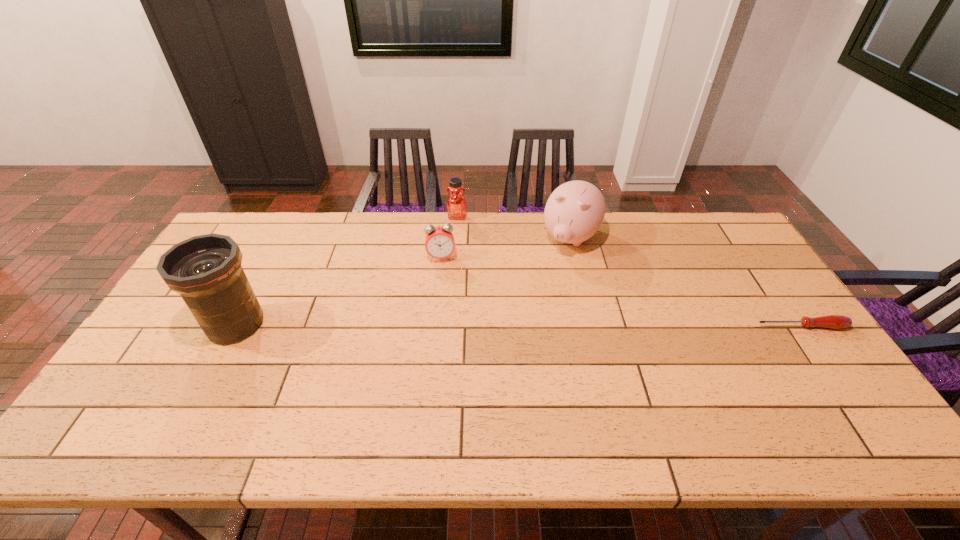
What are the coordinates of `free location located at the snout of the second tallest object` in the screenshot? It's located at (524, 322).

The height and width of the screenshot is (540, 960). I want to click on blank area located 0.090m at the snout of the second tallest object, so click(x=551, y=275).

Locate an element on the screen. The image size is (960, 540). vacant space located at the snout of the second tallest object is located at coordinates (540, 295).

This screenshot has width=960, height=540. In order to click on vacant region located on the front label of the third shortest object in this screenshot , I will do `click(445, 299)`.

You are a GUI agent. You are given a task and a screenshot of the screen. Output one action in this format:
    pyautogui.click(x=<x>, y=<y>)
    Task: Click on the vacant position located 0.240m on the front label of the third shortest object
    Image resolution: width=960 pixels, height=540 pixels.
    Given the screenshot: What is the action you would take?
    pyautogui.click(x=450, y=266)

The height and width of the screenshot is (540, 960). What are the coordinates of `vacant space located on the front label of the third shortest object` in the screenshot? It's located at (455, 232).

I want to click on vacant region located 0.090m on the front-facing side of the second shortest object, so click(x=444, y=283).

The height and width of the screenshot is (540, 960). I want to click on free space located 0.200m on the front-facing side of the second shortest object, so click(447, 308).

The height and width of the screenshot is (540, 960). I want to click on vacant area located on the front-facing side of the second shortest object, so click(x=447, y=311).

Identify the location of piggy bank that is at the far edge. This screenshot has width=960, height=540. (575, 210).